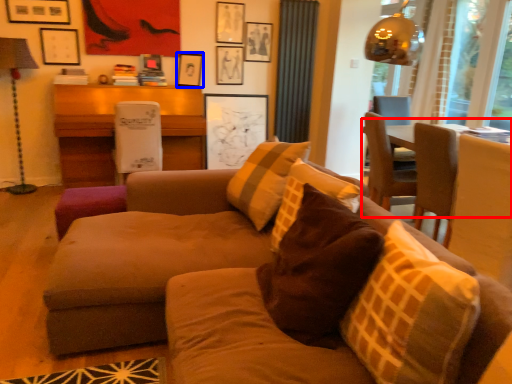
Question: Which point is closer to the camera, table (highlighted by a red box) or picture frame (highlighted by a blue box)?

Choices:
 (A) table
 (B) picture frame

Answer: (A)